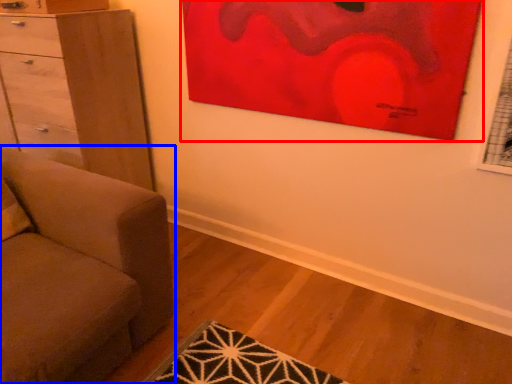
Question: Which of the following is the closest to the observer, picture frame (highlighted by a red box) or studio couch (highlighted by a blue box)?

Choices:
 (A) picture frame
 (B) studio couch

Answer: (B)